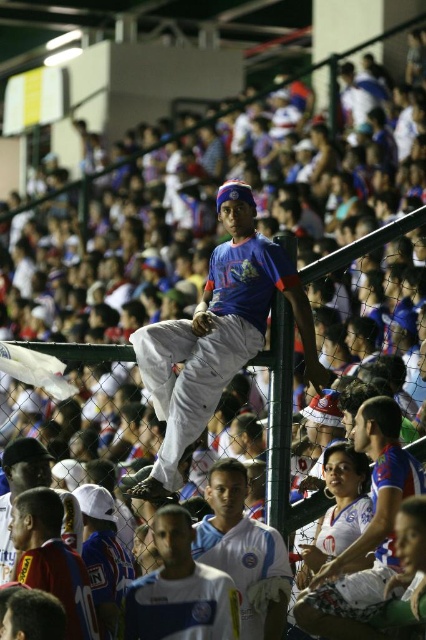
Based on the coordinates provided, which object is located at point (244, 552) in the image?

The point (244, 552) corresponds to the white matte jersey at center.

You are a photographer at the sports event. You need to capture a photo that includes both the white matte jersey at center and the white jersey at lower left. Based on their positions, which jersey should you focus on first to ensure both are in frame?

The white matte jersey at center is located below the white jersey at lower left, so you should focus on the white jersey at lower left first to ensure both are in frame.